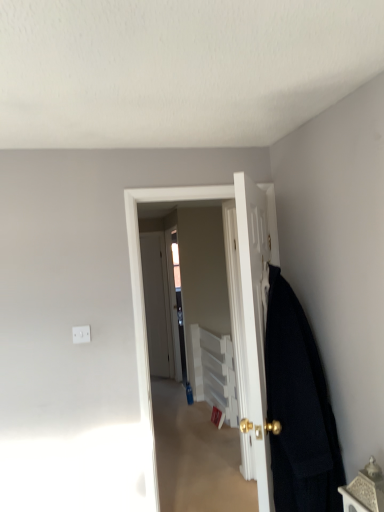
Identify the location of metallic textured box at lower right. (365, 490).

Describe the element at coordinates (143, 304) in the screenshot. I see `white glossy door at center, which appears as the 2th door when viewed from the front` at that location.

This screenshot has width=384, height=512. What do you see at coordinates (176, 304) in the screenshot?
I see `clear glass screen door at center` at bounding box center [176, 304].

The image size is (384, 512). I want to click on metallic textured box at lower right, so click(365, 490).

How distant is dark woolen blanket at right from white glossy door at center, which is the first door from front to back?

A distance of 6.53 inches exists between dark woolen blanket at right and white glossy door at center, which is the first door from front to back.

Looking at this image, can white glossy door at center, which is the first door from front to back, be found inside dark woolen blanket at right?

No, white glossy door at center, which is the first door from front to back, is not a part of dark woolen blanket at right.

From the image's perspective, is dark woolen blanket at right over white glossy door at center, which is the first door from front to back?

No, from the image's perspective, dark woolen blanket at right is not over white glossy door at center, which is the first door from front to back.

Which object is further away from the camera, dark woolen blanket at right or white glossy door at center, which is the first door from front to back?

dark woolen blanket at right is further from the camera.

Is white plastic cabinet at center turned away from clear glass screen door at center?

No, white plastic cabinet at center is not facing the opposite direction of clear glass screen door at center.

From a real-world perspective, which object stands above the other?

From a 3D spatial view, clear glass screen door at center is above.

Which object is positioned more to the left, metallic textured box at lower right or white glossy door at center, which appears as the 2th door when viewed from the front?

Positioned to the left is white glossy door at center, which appears as the 2th door when viewed from the front.

Considering the relative sizes of metallic textured box at lower right and white glossy door at center, which appears as the 2th door when viewed from the front, in the image provided, is metallic textured box at lower right bigger than white glossy door at center, which appears as the 2th door when viewed from the front,?

No, metallic textured box at lower right is not bigger than white glossy door at center, which appears as the 2th door when viewed from the front.

In the scene shown: Can you confirm if metallic textured box at lower right is thinner than white glossy door at center, the 1th door when ordered from back to front?

No, metallic textured box at lower right is not thinner than white glossy door at center, the 1th door when ordered from back to front.

Considering the points (346, 509) and (160, 191), which point is in front, point (346, 509) or point (160, 191)?

The point (346, 509) is closer to the camera.

From a real-world perspective, is white glossy door at center, which appears as the 2th door when viewed from the front, positioned over clear glass screen door at center based on gravity?

Correct, in the physical world, white glossy door at center, which appears as the 2th door when viewed from the front, is higher than clear glass screen door at center.

Does white glossy door at center, which appears as the 2th door when viewed from the front, lie behind clear glass screen door at center?

No, it is in front of clear glass screen door at center.

Between white glossy door at center, the 1th door when ordered from back to front, and clear glass screen door at center, which one has larger size?

With larger size is clear glass screen door at center.

Considering the sizes of objects metallic textured box at lower right and white glossy door at center, which is the first door from front to back, in the image provided, who is thinner, metallic textured box at lower right or white glossy door at center, which is the first door from front to back,?

metallic textured box at lower right is thinner.

Is metallic textured box at lower right positioned before white glossy door at center, which is the second door in back-to-front order?

Yes, the depth of metallic textured box at lower right is less than that of white glossy door at center, which is the second door in back-to-front order.

Locate an element on the screen. furniture in front of the white glossy door at center, which is the second door in back-to-front order is located at coordinates (365, 490).

Can you tell me how much metallic textured box at lower right and white glossy door at center, which is the first door from front to back, differ in facing direction?

32.1 degrees.

Would you say white glossy door at center, the 1th door when ordered from back to front, contains white plastic cabinet at center?

Actually, white plastic cabinet at center is outside white glossy door at center, the 1th door when ordered from back to front.

From the image's perspective, is white glossy door at center, the 1th door when ordered from back to front, below white plastic cabinet at center?

No, from the image's perspective, white glossy door at center, the 1th door when ordered from back to front, is not below white plastic cabinet at center.

From a real-world perspective, does white glossy door at center, which appears as the 2th door when viewed from the front, stand above white plastic cabinet at center?

Indeed, from a real-world perspective, white glossy door at center, which appears as the 2th door when viewed from the front, stands above white plastic cabinet at center.

Between white glossy door at center, the 1th door when ordered from back to front, and white plastic cabinet at center, which one is positioned in front?

white glossy door at center, the 1th door when ordered from back to front, is more forward.

Is point (322, 489) positioned in front of point (379, 503)?

No, (322, 489) is behind (379, 503).

Between dark woolen blanket at right and metallic textured box at lower right, which one has smaller size?

metallic textured box at lower right.

Based on the photo, is dark woolen blanket at right turned away from metallic textured box at lower right?

dark woolen blanket at right does not have its back to metallic textured box at lower right.

Find the location of `blanket behind the white glossy door at center, which is the first door from front to back`. blanket behind the white glossy door at center, which is the first door from front to back is located at coordinates (299, 409).

The image size is (384, 512). Identify the location of cabinet in front of the clear glass screen door at center. (213, 372).

Based on the photo, which object lies nearer to the anchor point white glossy door at center, the 1th door when ordered from back to front, dark woolen blanket at right or white glossy door at center, which is the first door from front to back?

white glossy door at center, which is the first door from front to back, lies closer to white glossy door at center, the 1th door when ordered from back to front, than the other object.

From the image, which object appears to be nearer to white plastic cabinet at center, dark woolen blanket at right or clear glass screen door at center?

clear glass screen door at center.

Looking at the image, which one is located closer to white glossy door at center, which is the first door from front to back, white plastic cabinet at center or white glossy door at center, which appears as the 2th door when viewed from the front?

white glossy door at center, which appears as the 2th door when viewed from the front, lies closer to white glossy door at center, which is the first door from front to back, than the other object.

Estimate the real-world distances between objects in this image. Which object is further from white glossy door at center, which appears as the 2th door when viewed from the front, white glossy door at center, which is the first door from front to back, or clear glass screen door at center?

clear glass screen door at center lies further to white glossy door at center, which appears as the 2th door when viewed from the front, than the other object.

Considering their positions, is dark woolen blanket at right positioned further to metallic textured box at lower right than white glossy door at center, the 1th door when ordered from back to front?

→ Based on the image, white glossy door at center, the 1th door when ordered from back to front, appears to be further to metallic textured box at lower right.

Consider the image. Which object lies nearer to the anchor point white plastic cabinet at center, clear glass screen door at center or white glossy door at center, which is the first door from front to back?

clear glass screen door at center is positioned closer to the anchor white plastic cabinet at center.

Considering their positions, is clear glass screen door at center positioned further to dark woolen blanket at right than metallic textured box at lower right?

clear glass screen door at center is further to dark woolen blanket at right.

Based on their spatial positions, is dark woolen blanket at right or white glossy door at center, which is the second door in back-to-front order, closer to clear glass screen door at center?

white glossy door at center, which is the second door in back-to-front order, lies closer to clear glass screen door at center than the other object.

Locate an element on the screen. This screenshot has height=512, width=384. door located between dark woolen blanket at right and white plastic cabinet at center in the depth direction is located at coordinates (143, 304).

The image size is (384, 512). I want to click on blanket between white glossy door at center, which is the first door from front to back, and white plastic cabinet at center in the front-back direction, so [x=299, y=409].

This screenshot has height=512, width=384. I want to click on cabinet between dark woolen blanket at right and clear glass screen door at center from front to back, so click(x=213, y=372).

Where is `blanket between white glossy door at center, which is the second door in back-to-front order, and white glossy door at center, the 1th door when ordered from back to front, along the z-axis`? blanket between white glossy door at center, which is the second door in back-to-front order, and white glossy door at center, the 1th door when ordered from back to front, along the z-axis is located at coordinates (299, 409).